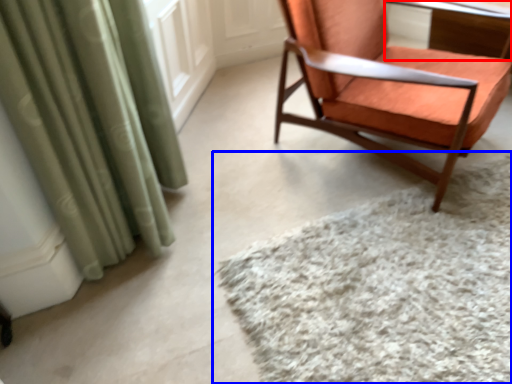
Question: Which point is closer to the camera, table (highlighted by a red box) or mat (highlighted by a blue box)?

Choices:
 (A) table
 (B) mat

Answer: (B)